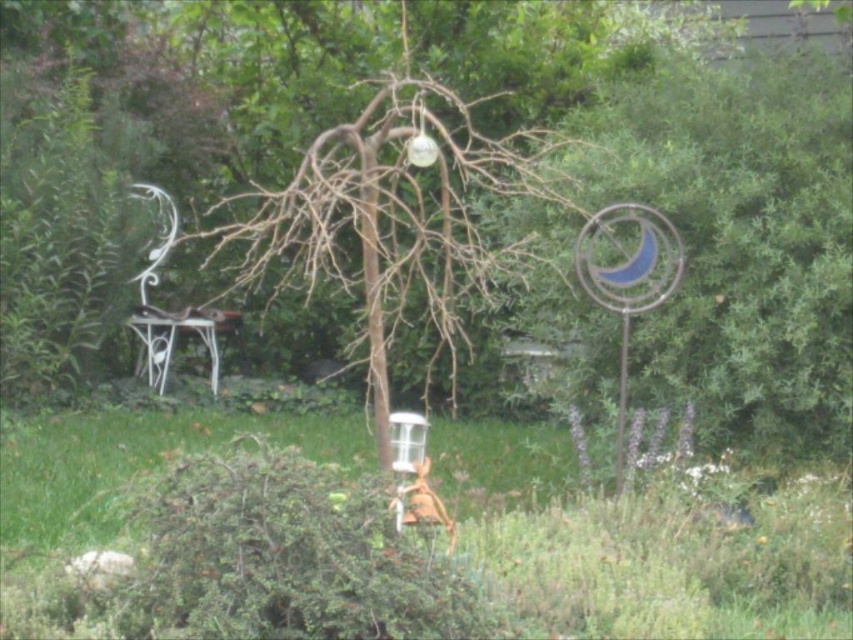
Question: Among these points, which one is farthest from the camera?

Choices:
 (A) (465, 104)
 (B) (834, 449)

Answer: (A)

Question: Which point is closer to the camera taking this photo?

Choices:
 (A) (404, 212)
 (B) (231, 310)

Answer: (A)

Question: Is metallic wire sculpture at right to the left of white wrought iron chair at left from the viewer's perspective?

Choices:
 (A) no
 (B) yes

Answer: (A)

Question: Is metallic wire sculpture at right thinner than white wrought iron chair at left?

Choices:
 (A) yes
 (B) no

Answer: (B)

Question: Which of the following is the farthest from the observer?

Choices:
 (A) (746, 70)
 (B) (276, 221)
 (C) (200, 333)

Answer: (C)

Question: Does metallic wire sculpture at right have a lesser width compared to white wrought iron chair at left?

Choices:
 (A) yes
 (B) no

Answer: (B)